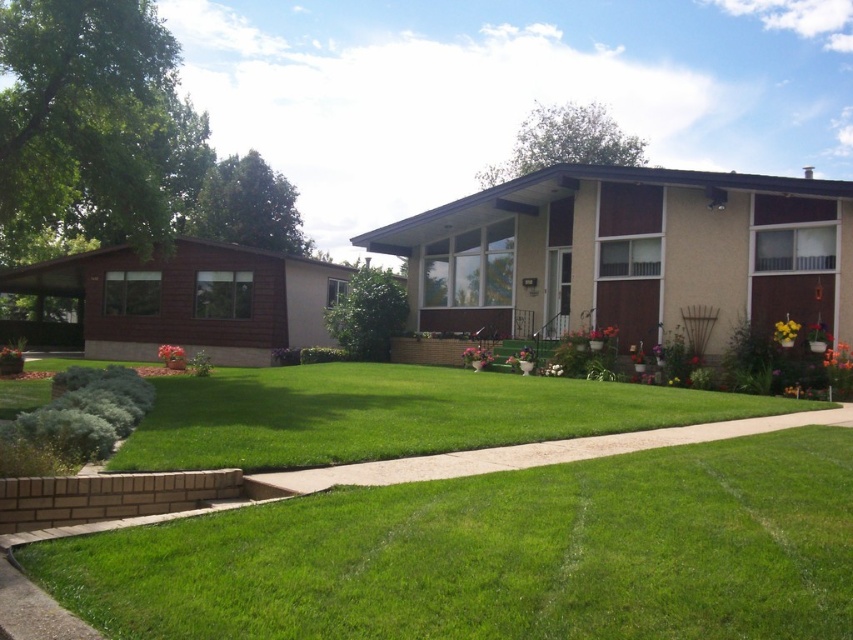
Is the position of green grass at lower left more distant than that of green concrete sidewalk at center?

That is False.

Who is positioned more to the left, green grass at lower left or green concrete sidewalk at center?

Positioned to the left is green grass at lower left.

What are the coordinates of `green grass at lower left` in the screenshot? It's located at (498, 554).

Where is `green grass at lower left`? Image resolution: width=853 pixels, height=640 pixels. green grass at lower left is located at coordinates (498, 554).

From the picture: Can you confirm if yellow matte flower at lower right is shorter than pink matte flower pot at center?

No.

Is yellow matte flower at lower right thinner than pink matte flower pot at center?

Yes.

This screenshot has height=640, width=853. What do you see at coordinates (785, 332) in the screenshot? I see `yellow matte flower at lower right` at bounding box center [785, 332].

Identify the location of yellow matte flower at lower right. Image resolution: width=853 pixels, height=640 pixels. (785, 332).

Who is more distant from viewer, [701,483] or [460,400]?

The point [460,400] is behind.

Where is `green grass at lower left`? This screenshot has width=853, height=640. green grass at lower left is located at coordinates (498, 554).

Identify the location of green grass at lower left. (498, 554).